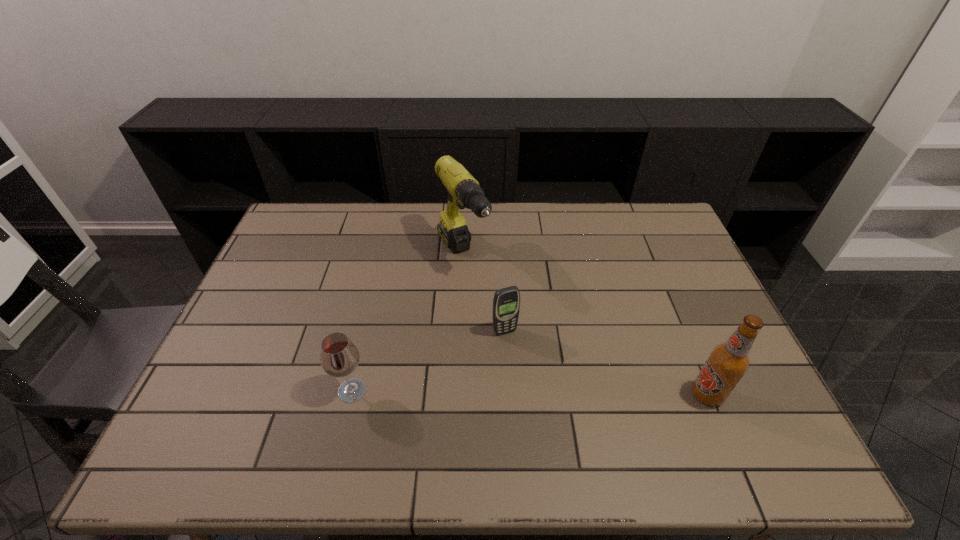
Identify the location of the leftmost object. (339, 357).

Identify the location of the rightmost object. This screenshot has width=960, height=540. (727, 363).

This screenshot has width=960, height=540. In order to click on drill in this screenshot , I will do `click(463, 189)`.

Find the location of `the farthest object`. the farthest object is located at coordinates (463, 189).

At what (x,y) coordinates should I click in order to perform the action: click on cellular telephone. Please return your answer as a coordinate pair (x, y). Looking at the image, I should click on (506, 303).

Locate an element on the screen. the third nearest object is located at coordinates (506, 303).

I want to click on vacant space situated on the right of the wineglass, so click(454, 391).

I want to click on vacant space located on the front label of the rightmost object, so click(x=556, y=395).

You are a GUI agent. You are given a task and a screenshot of the screen. Output one action in this format:
    pyautogui.click(x=<x>, y=<y>)
    Task: Click on the vacant region located 0.340m on the front label of the rightmost object
    
    Given the screenshot: What is the action you would take?
    pyautogui.click(x=552, y=395)

Where is `free space located 0.060m on the front label of the rightmost object`? The image size is (960, 540). free space located 0.060m on the front label of the rightmost object is located at coordinates (666, 395).